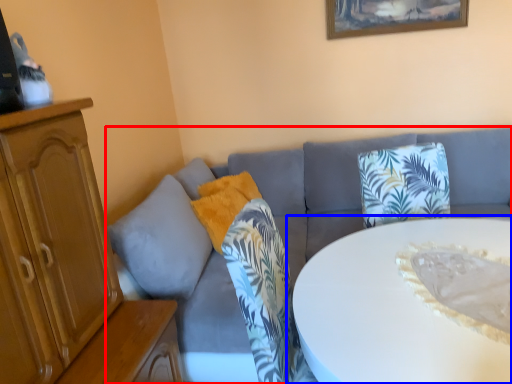
Question: Which object appears farthest to the camera in this image, studio couch (highlighted by a red box) or table (highlighted by a blue box)?

Choices:
 (A) studio couch
 (B) table

Answer: (A)